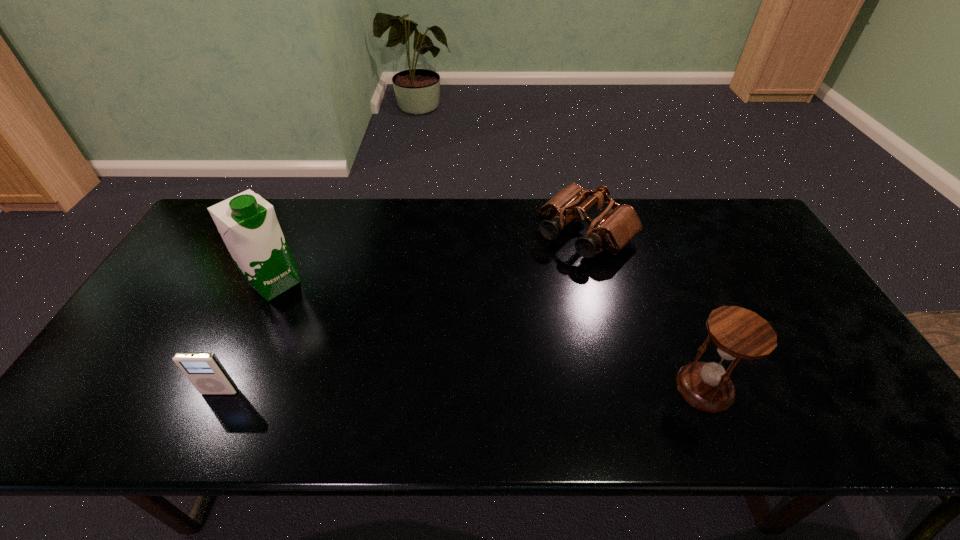
Find the location of a particular element. The image size is (960, 540). iPod is located at coordinates (204, 370).

Find the location of a particular element. the second tallest object is located at coordinates (738, 333).

In order to click on binoculars in this screenshot , I will do `click(615, 227)`.

The image size is (960, 540). I want to click on the tallest object, so click(x=247, y=223).

The width and height of the screenshot is (960, 540). I want to click on vacant space located 0.140m on the right of the second tallest object, so click(x=792, y=388).

The image size is (960, 540). I want to click on blank area located through the eyepieces of the binoculars, so click(x=474, y=341).

The height and width of the screenshot is (540, 960). In order to click on free location located through the eyepieces of the binoculars in this screenshot , I will do `click(495, 320)`.

Find the location of `vacant space located 0.240m through the eyepieces of the binoculars`. vacant space located 0.240m through the eyepieces of the binoculars is located at coordinates click(x=512, y=305).

At what (x,y) coordinates should I click in order to perform the action: click on vacant space located 0.300m on the front-facing side of the tallest object. Please return your answer as a coordinate pair (x, y). Looking at the image, I should click on (357, 355).

Where is `vacant space located on the front-facing side of the tallest object`? Image resolution: width=960 pixels, height=540 pixels. vacant space located on the front-facing side of the tallest object is located at coordinates (322, 324).